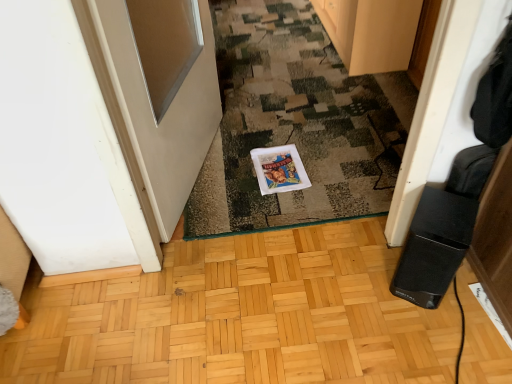
Locate an element on the screen. vacant space to the right of white glossy door at left is located at coordinates (286, 161).